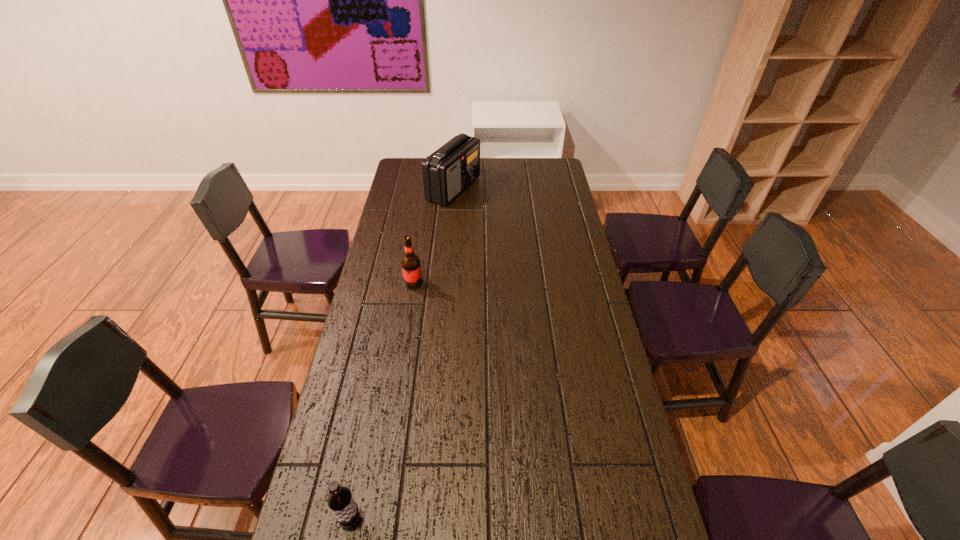
This screenshot has width=960, height=540. What are the coordinates of `vacant space that is in between the farthest object and the shortest object` in the screenshot? It's located at (402, 354).

Locate an element on the screen. This screenshot has width=960, height=540. free space between the right root beer and the nearest object is located at coordinates (382, 401).

At what (x,y) coordinates should I click in order to perform the action: click on free space between the second nearest object and the nearer root beer. Please return your answer as a coordinate pair (x, y). The height and width of the screenshot is (540, 960). Looking at the image, I should click on (382, 401).

Select which object appears as the second closest to the second farthest object. Please provide its 2D coordinates. Your answer should be formatted as a tuple, i.e. [(x, y)], where the tuple contains the x and y coordinates of a point satisfying the conditions above.

[(340, 500)]

Locate an element on the screen. Image resolution: width=960 pixels, height=540 pixels. object that is the closest one to the right root beer is located at coordinates (451, 169).

Find the location of a particular element. This screenshot has width=960, height=540. vacant space that satisfies the following two spatial constraints: 1. on the back side of the farther root beer; 2. on the left side of the leftmost object is located at coordinates (397, 284).

Image resolution: width=960 pixels, height=540 pixels. Identify the location of free location that satisfies the following two spatial constraints: 1. on the back side of the left root beer; 2. on the left side of the second nearest object. (397, 284).